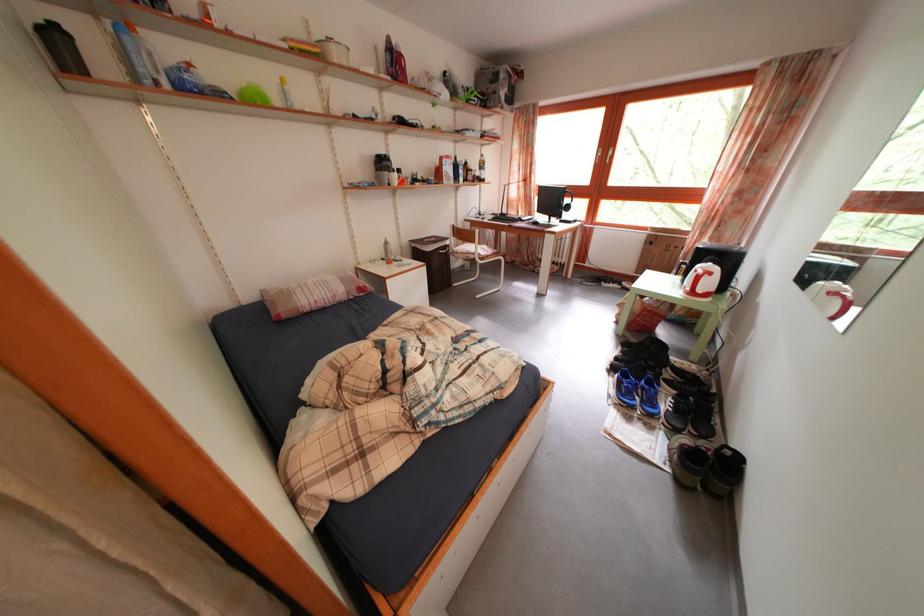
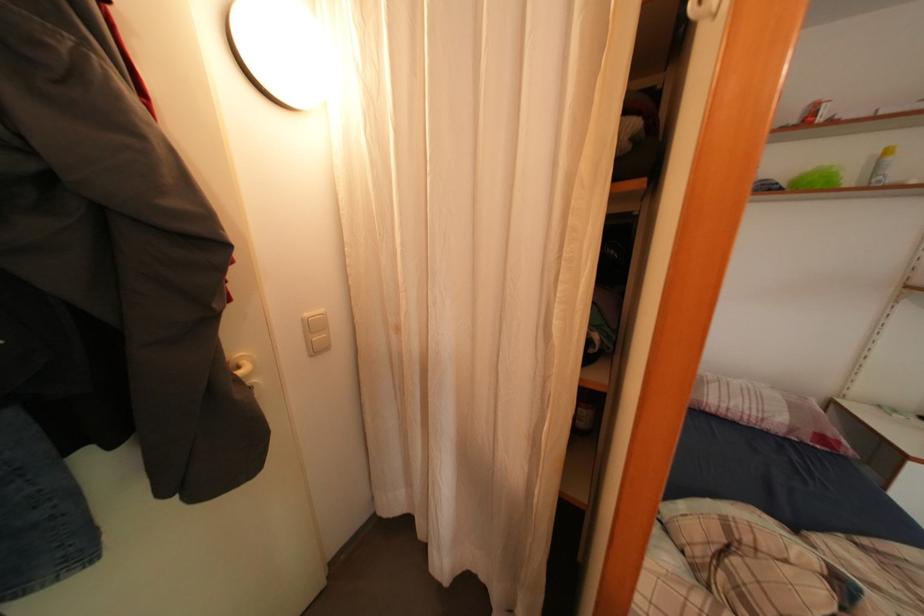
Question: How did the camera likely rotate?

Choices:
 (A) Left
 (B) Right
 (C) Up
 (D) Down

Answer: (A)